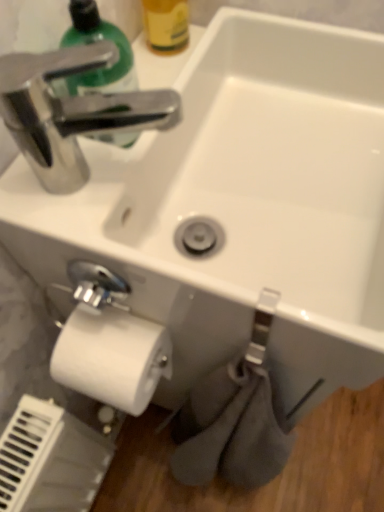
Question: Is shiny green plastic soap dispenser at upper left oriented towards yellow matte bottle at upper center?

Choices:
 (A) yes
 (B) no

Answer: (B)

Question: Is shiny green plastic soap dispenser at upper left positioned before yellow matte bottle at upper center?

Choices:
 (A) no
 (B) yes

Answer: (B)

Question: Considering the relative sizes of shiny green plastic soap dispenser at upper left and yellow matte bottle at upper center in the image provided, is shiny green plastic soap dispenser at upper left wider than yellow matte bottle at upper center?

Choices:
 (A) yes
 (B) no

Answer: (A)

Question: Is shiny green plastic soap dispenser at upper left to the right of yellow matte bottle at upper center from the viewer's perspective?

Choices:
 (A) no
 (B) yes

Answer: (A)

Question: Does shiny green plastic soap dispenser at upper left appear on the left side of yellow matte bottle at upper center?

Choices:
 (A) no
 (B) yes

Answer: (B)

Question: Is white matte toilet paper at lower left wider or thinner than shiny green plastic soap dispenser at upper left?

Choices:
 (A) wide
 (B) thin

Answer: (A)

Question: Considering the positions of point (125, 396) and point (64, 93), is point (125, 396) closer or farther from the camera than point (64, 93)?

Choices:
 (A) closer
 (B) farther

Answer: (A)

Question: Visually, is white matte toilet paper at lower left positioned to the left or to the right of shiny green plastic soap dispenser at upper left?

Choices:
 (A) right
 (B) left

Answer: (A)

Question: Is white matte toilet paper at lower left bigger or smaller than shiny green plastic soap dispenser at upper left?

Choices:
 (A) big
 (B) small

Answer: (A)

Question: Based on their positions, is shiny green plastic soap dispenser at upper left located to the left or right of yellow matte bottle at upper center?

Choices:
 (A) right
 (B) left

Answer: (B)

Question: From the image's perspective, is shiny green plastic soap dispenser at upper left positioned above or below yellow matte bottle at upper center?

Choices:
 (A) below
 (B) above

Answer: (A)

Question: Relative to yellow matte bottle at upper center, is shiny green plastic soap dispenser at upper left in front or behind?

Choices:
 (A) front
 (B) behind

Answer: (A)

Question: In terms of width, does shiny green plastic soap dispenser at upper left look wider or thinner when compared to yellow matte bottle at upper center?

Choices:
 (A) wide
 (B) thin

Answer: (A)

Question: Looking at the image, does white matte toilet paper at lower left seem bigger or smaller compared to yellow matte bottle at upper center?

Choices:
 (A) small
 (B) big

Answer: (B)

Question: Relative to yellow matte bottle at upper center, is white matte toilet paper at lower left in front or behind?

Choices:
 (A) behind
 (B) front

Answer: (B)